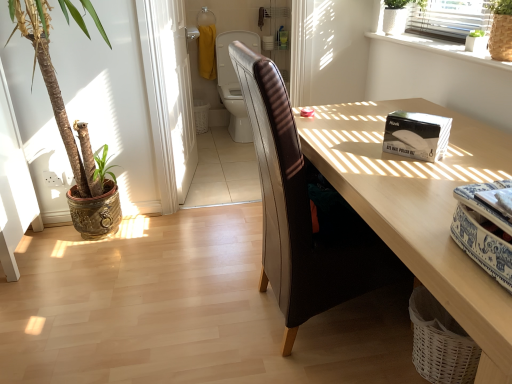
Locate an element on the screen. This screenshot has height=384, width=512. free space in front of green leafy plant in textured pot at left, which is the 4th houseplant in right-to-left order is located at coordinates (70, 299).